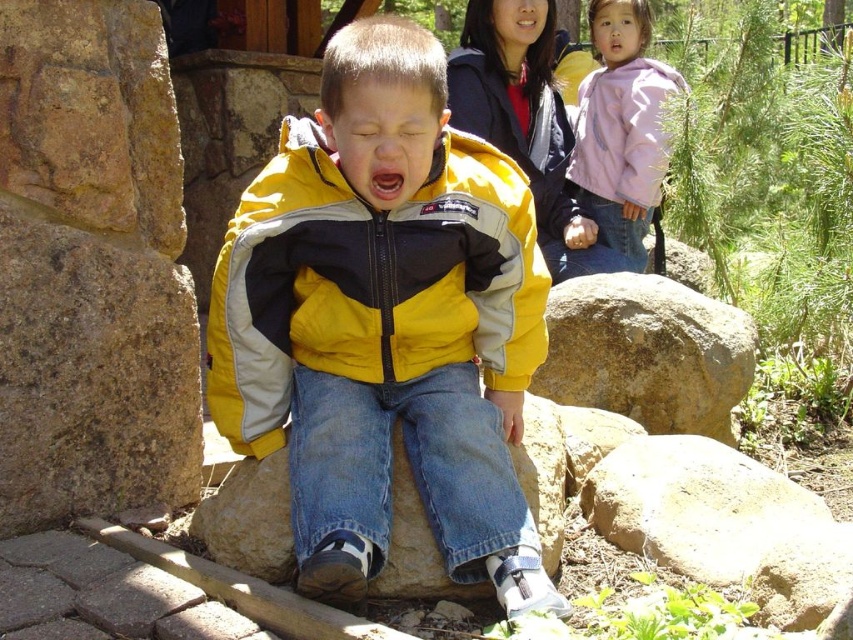
Does point (289, 499) come closer to viewer compared to point (511, 67)?

Yes, point (289, 499) is in front of point (511, 67).

Which is above, yellow matte jacket at center or matte black jacket at upper center?

matte black jacket at upper center is above.

Is point (480, 531) positioned before point (457, 48)?

That is True.

Image resolution: width=853 pixels, height=640 pixels. In order to click on yellow matte jacket at center in this screenshot , I will do `click(386, 324)`.

Who is positioned more to the right, rocky brown boulder at right or pastel pink fleece at upper right?

Positioned to the right is pastel pink fleece at upper right.

Who is higher up, rocky brown boulder at right or pastel pink fleece at upper right?

pastel pink fleece at upper right

Does point (548, 300) come farther from viewer compared to point (613, 28)?

No, (548, 300) is closer to viewer.

Identify the location of rocky brown boulder at right. This screenshot has width=853, height=640. pos(647,353).

Is matte black jacket at upper center to the left of pastel pink fleece at upper right from the viewer's perspective?

Correct, you'll find matte black jacket at upper center to the left of pastel pink fleece at upper right.

Describe the element at coordinates (518, 104) in the screenshot. I see `matte black jacket at upper center` at that location.

Is point (508, 92) positioned behind point (624, 100)?

No, it is not.

This screenshot has height=640, width=853. What are the coordinates of `matte black jacket at upper center` in the screenshot? It's located at (518, 104).